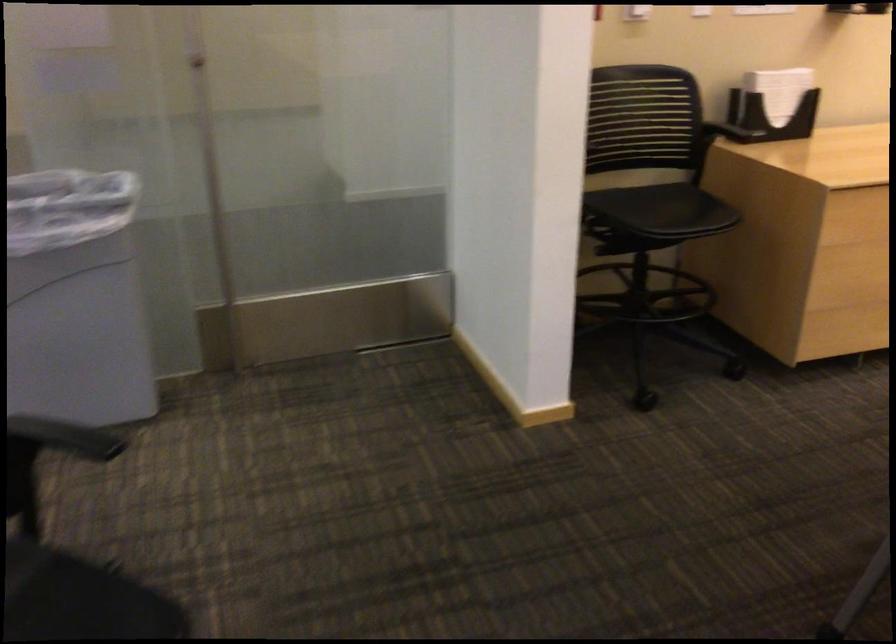
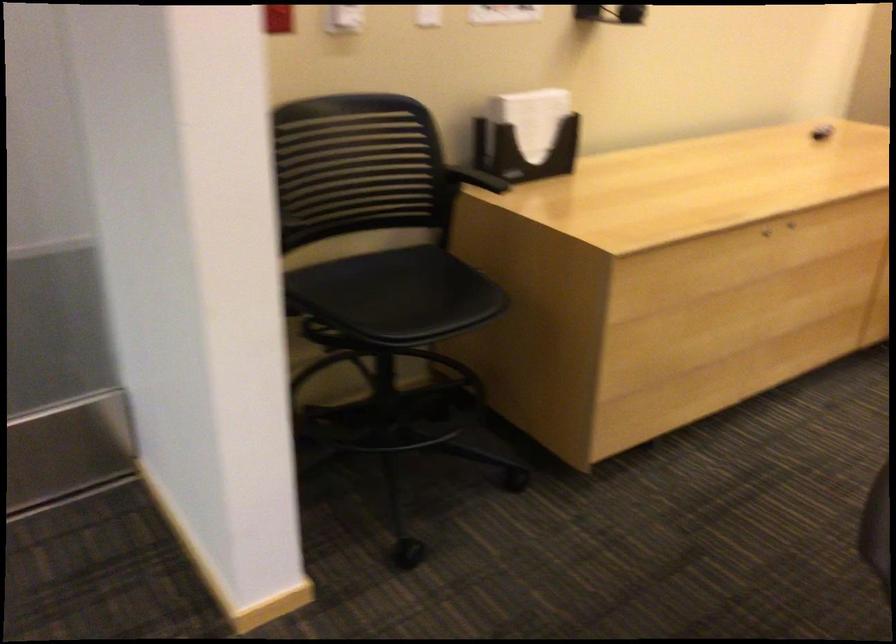
Question: The images are taken continuously from a first-person perspective. In which direction is your viewpoint rotating?

Choices:
 (A) Left
 (B) Right
 (C) Up
 (D) Down

Answer: (B)